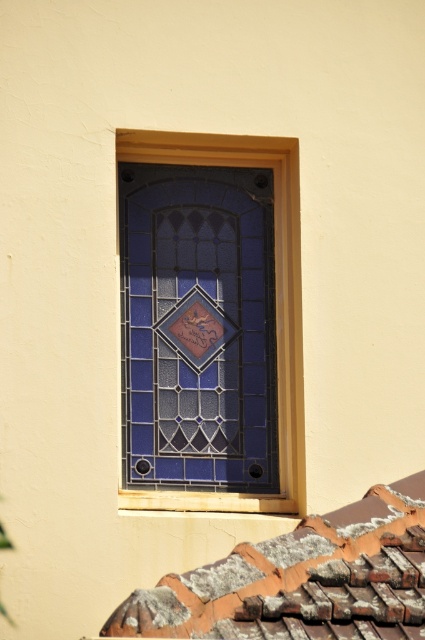
Does rusty clay tiles at lower right appear under blue stained glass at center?

Yes, rusty clay tiles at lower right is below blue stained glass at center.

Is point (422, 618) positioned before point (192, 502)?

Yes, it is in front of point (192, 502).

This screenshot has height=640, width=425. Describe the element at coordinates (300, 579) in the screenshot. I see `rusty clay tiles at lower right` at that location.

Where is `rusty clay tiles at lower right`? This screenshot has height=640, width=425. rusty clay tiles at lower right is located at coordinates (300, 579).